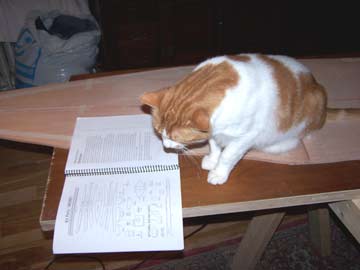
Identify the location of table. The image size is (360, 270). (216, 195).